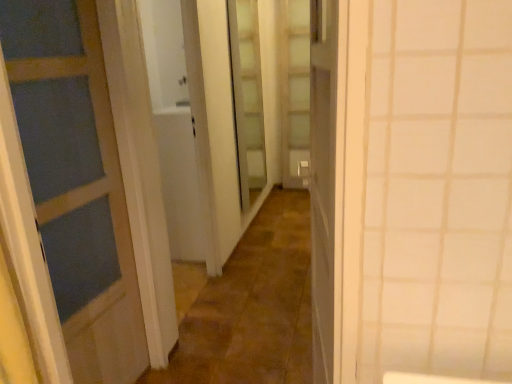
Locate an element on the screen. This screenshot has height=384, width=512. vacant space situated above brown stone alley at center (from a real-world perspective) is located at coordinates (274, 268).